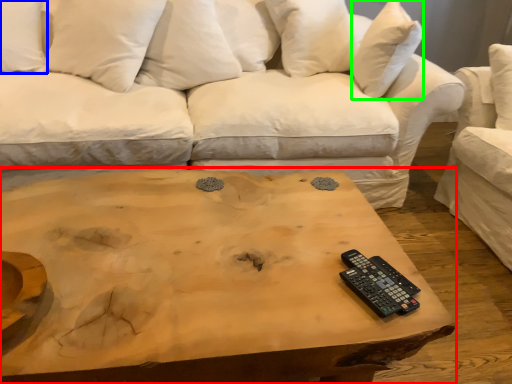
Question: Which is nearer to the coffee table (highlighted by a red box)? pillow (highlighted by a blue box) or pillow (highlighted by a green box).

Choices:
 (A) pillow
 (B) pillow

Answer: (B)